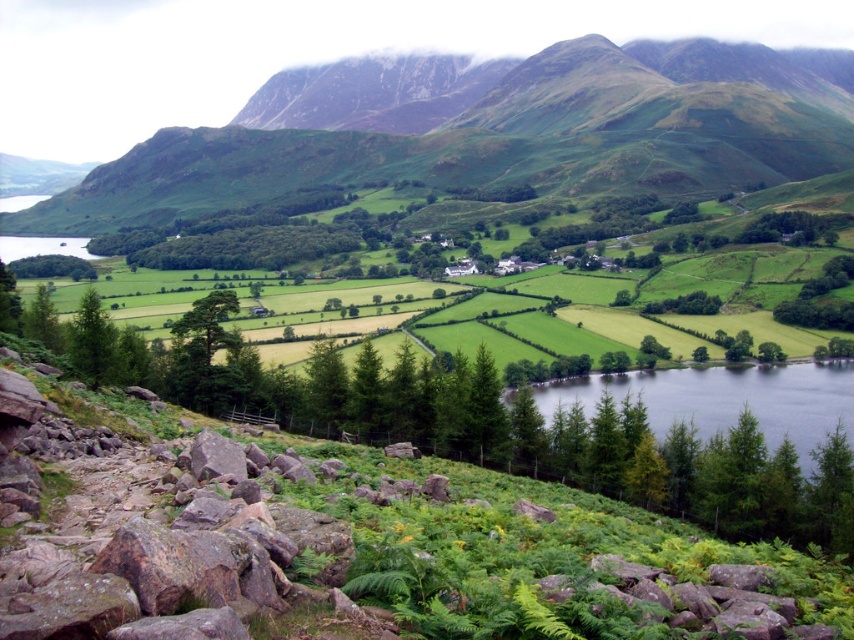
You are standing at the point with coordinates (x=502, y=138) in the rural landscape. What is the name of the object located exactly at this point?

The object located exactly at point (x=502, y=138) is the green grassy mountain at upper center.

You are a hiker standing at the rocky slope in the foreground of the rural landscape. You notice the green grassy water at lower center and the green leafy tree at lower left. Which object is taller?

The green leafy tree at lower left is taller than the green grassy water at lower center.

Consider the image. You are a hiker standing at the base of the green grassy mountain at upper center and want to reach the green grassy water at lower center. Which direction should you move to get there?

The green grassy mountain at upper center is to the left of the green grassy water at lower center, so you should move to the right to reach the green grassy water at lower center.